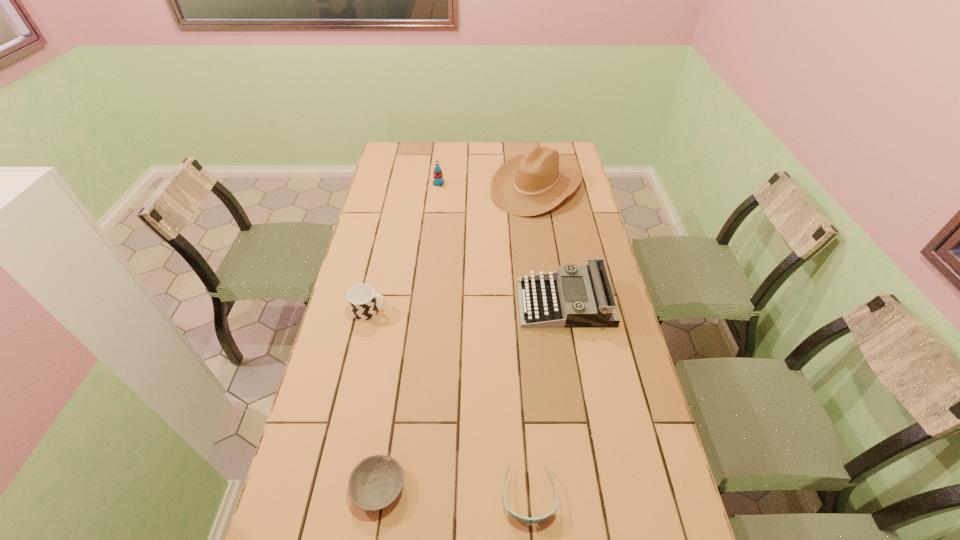
Image resolution: width=960 pixels, height=540 pixels. What are the coordinates of `vacant space positioned on the typing side of the typewriter` in the screenshot? It's located at (501, 302).

Find the location of a particular element. This screenshot has width=960, height=540. free space located 0.140m on the side of the third shortest object with the handle is located at coordinates (430, 312).

I want to click on free space located 0.190m on the back of the bowl, so click(393, 393).

Locate an element on the screen. The height and width of the screenshot is (540, 960). object that is at the far edge is located at coordinates (526, 185).

The width and height of the screenshot is (960, 540). Identify the location of cup present at the left edge. (362, 299).

Find the location of a particular element. bowl present at the left edge is located at coordinates (376, 481).

Where is `cowboy hat that is at the right edge`? The width and height of the screenshot is (960, 540). cowboy hat that is at the right edge is located at coordinates (526, 185).

The width and height of the screenshot is (960, 540). Find the location of `typewriter located in the right edge section of the desktop`. typewriter located in the right edge section of the desktop is located at coordinates (556, 299).

Find the location of a particular element. This screenshot has width=960, height=540. object that is at the far right corner is located at coordinates (526, 185).

In the image, there is a desktop. Find the location of `vacant area at the far edge`. vacant area at the far edge is located at coordinates (420, 153).